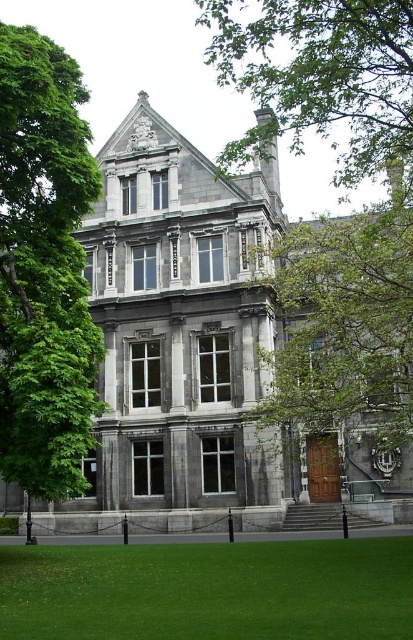
Does green leafy tree at left have a greater width compared to green grass at lower center?

In fact, green leafy tree at left might be narrower than green grass at lower center.

Is green leafy tree at left smaller than green grass at lower center?

Incorrect, green leafy tree at left is not smaller in size than green grass at lower center.

Does point (30, 141) come farther from viewer compared to point (287, 582)?

That is True.

Identify the location of green leafy tree at left. The width and height of the screenshot is (413, 640). (44, 268).

Who is higher up, green grass at lower center or green leafy tree at upper center?

green leafy tree at upper center is above.

Does green grass at lower center have a greater height compared to green leafy tree at upper center?

No.

You are a GUI agent. You are given a task and a screenshot of the screen. Output one action in this format:
    pyautogui.click(x=<x>, y=<y>)
    Task: Click on the green grass at lower center
    The height and width of the screenshot is (640, 413).
    Given the screenshot: What is the action you would take?
    pyautogui.click(x=208, y=589)

Can you confirm if green leafy tree at left is positioned to the left of green leafy tree at upper center?

Yes, green leafy tree at left is to the left of green leafy tree at upper center.

Can you confirm if green leafy tree at left is thinner than green leafy tree at upper center?

Correct, green leafy tree at left's width is less than green leafy tree at upper center's.

Does point (85, 424) lie behind point (336, 36)?

Yes, point (85, 424) is farther from viewer.

Locate an element on the screen. The image size is (413, 640). green leafy tree at left is located at coordinates (44, 268).